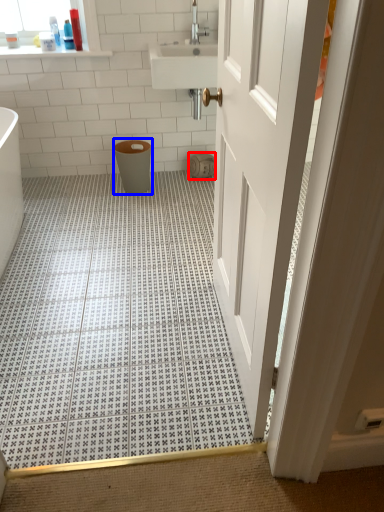
Question: Which object is closer to the camera taking this photo, toilet paper (highlighted by a red box) or toilet bowl (highlighted by a blue box)?

Choices:
 (A) toilet paper
 (B) toilet bowl

Answer: (B)